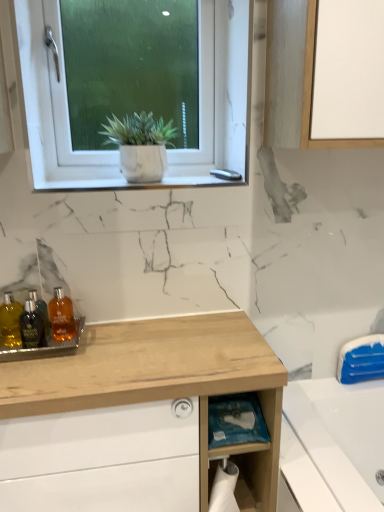
Identify the location of vacant space in front of shiny glass bottles at left, the first toiletry in the left-to-right sequence. Image resolution: width=384 pixels, height=512 pixels. (29, 376).